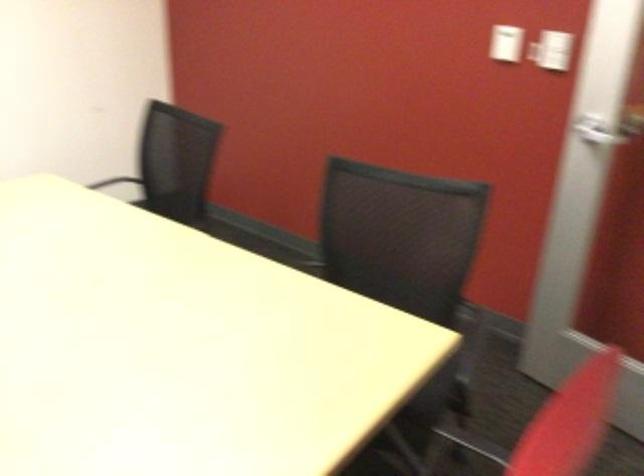
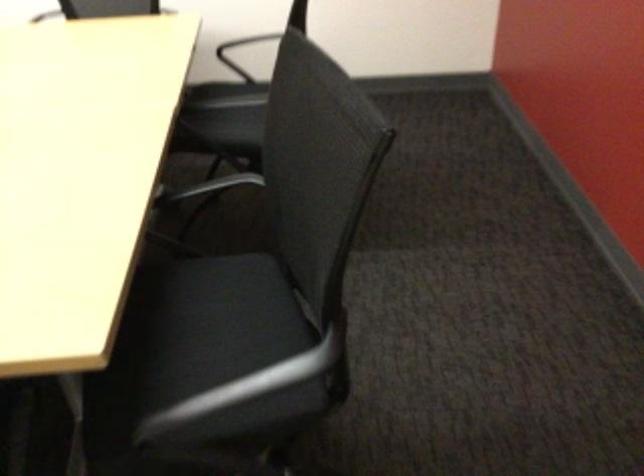
In the second image, find the point that corresponds to the point at 274,277 in the first image.

(209, 186)